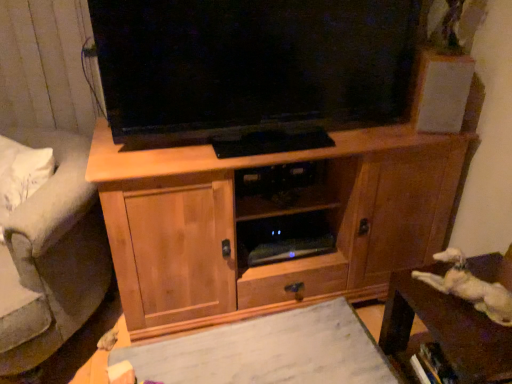
Question: Is white fluffy cat at lower right in front of or behind white matte paper at center in the image?

Choices:
 (A) front
 (B) behind

Answer: (A)

Question: From a real-world perspective, relative to white matte paper at center, is white fluffy cat at lower right vertically above or below?

Choices:
 (A) above
 (B) below

Answer: (A)

Question: Which is farther from the wooden cabinet at center?

Choices:
 (A) white matte speaker at upper right
 (B) gray fabric armchair at left
 (C) white fluffy cat at lower right
 (D) brown wooden table at lower right
 (E) white matte paper at center

Answer: (C)

Question: Based on their relative distances, which object is farther from the wooden cabinet at center?

Choices:
 (A) white fluffy cat at lower right
 (B) gray fabric armchair at left
 (C) brown wooden table at lower right
 (D) white matte paper at center
 (E) white matte speaker at upper right

Answer: (A)